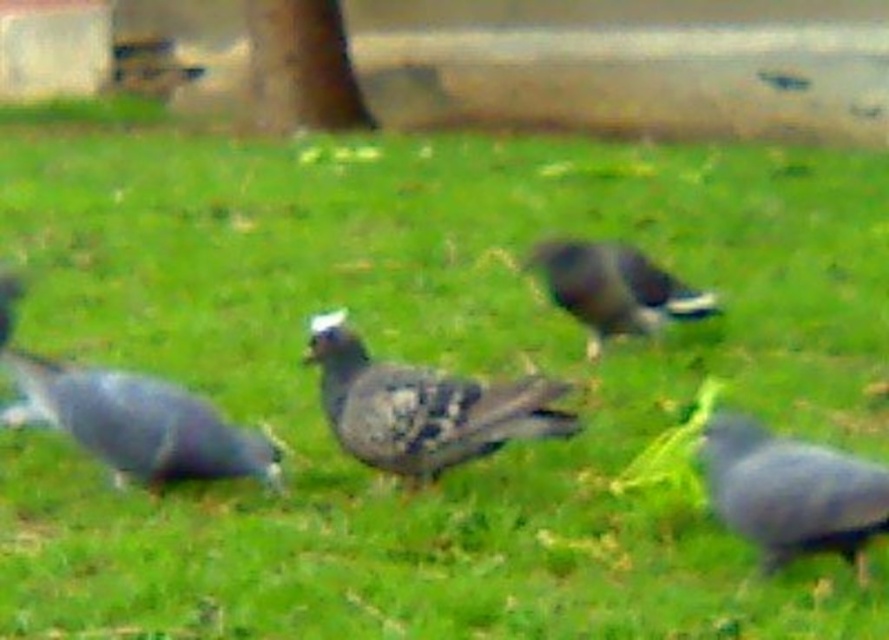
Question: Which object appears closest to the camera in this image?

Choices:
 (A) gray matte bird at center
 (B) speckled gray pigeon at center
 (C) matte gray pigeon at center

Answer: (B)

Question: Is speckled gray pigeon at center in front of gray matte bird at center?

Choices:
 (A) no
 (B) yes

Answer: (B)

Question: Estimate the real-world distances between objects in this image. Which object is closer to the gray matte bird at center?

Choices:
 (A) gray matte pigeon at lower right
 (B) speckled gray pigeon at center
 (C) matte gray pigeon at center

Answer: (B)

Question: Which of the following is the farthest from the observer?

Choices:
 (A) (87, 371)
 (B) (570, 248)

Answer: (B)

Question: Does matte gray pigeon at center appear on the left side of gray matte pigeon at lower right?

Choices:
 (A) no
 (B) yes

Answer: (B)

Question: In this image, where is speckled gray pigeon at center located relative to gray matte bird at center?

Choices:
 (A) right
 (B) left

Answer: (B)